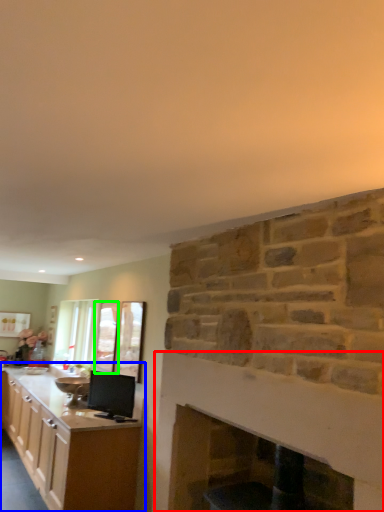
Question: Considering the real-world distances, which object is farthest from fireplace (highlighted by a red box)? cabinetry (highlighted by a blue box) or glass door (highlighted by a green box)?

Choices:
 (A) cabinetry
 (B) glass door

Answer: (B)